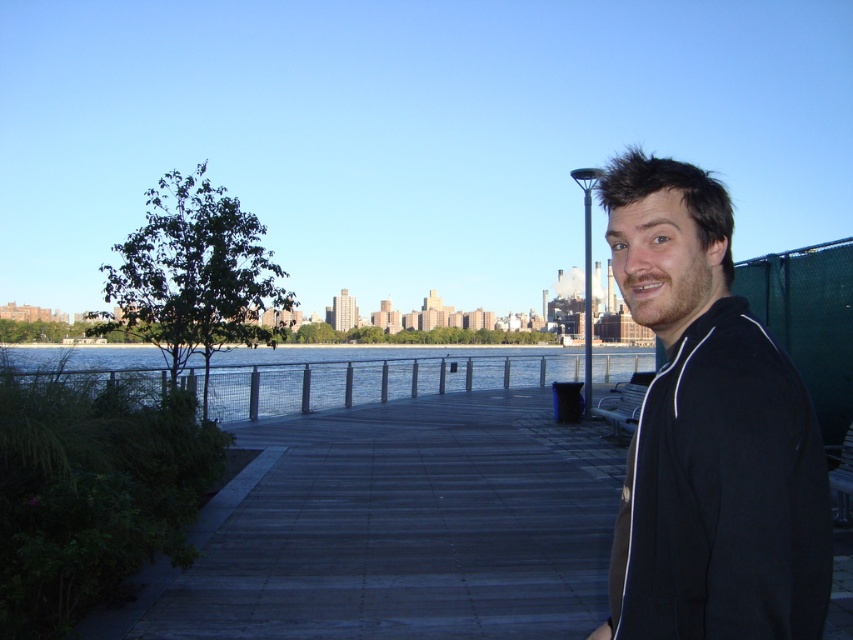
Is wooden planks at center positioned in front of black zip-up jacket at right?

No, wooden planks at center is further to the viewer.

Looking at this image, does wooden planks at center have a lesser width compared to black zip-up jacket at right?

No.

Is point (320, 627) more distant than point (608, 586)?

Yes.

Where is `wooden planks at center`? The width and height of the screenshot is (853, 640). wooden planks at center is located at coordinates pos(410,528).

Is point (759, 595) closer to viewer compared to point (283, 401)?

That is True.

Describe the element at coordinates (708, 433) in the screenshot. I see `black zip-up jacket at right` at that location.

Between point (691, 189) and point (219, 378), which one is positioned behind?

Point (219, 378)

Identify the location of black zip-up jacket at right. (708, 433).

Who is lower down, wooden planks at center or clear water at center?

wooden planks at center is lower down.

Between point (215, 620) and point (538, 356), which one is positioned behind?

Point (538, 356)

Which is behind, point (505, 616) or point (97, 380)?

Point (97, 380)

Where is `wooden planks at center`? This screenshot has height=640, width=853. wooden planks at center is located at coordinates (410, 528).